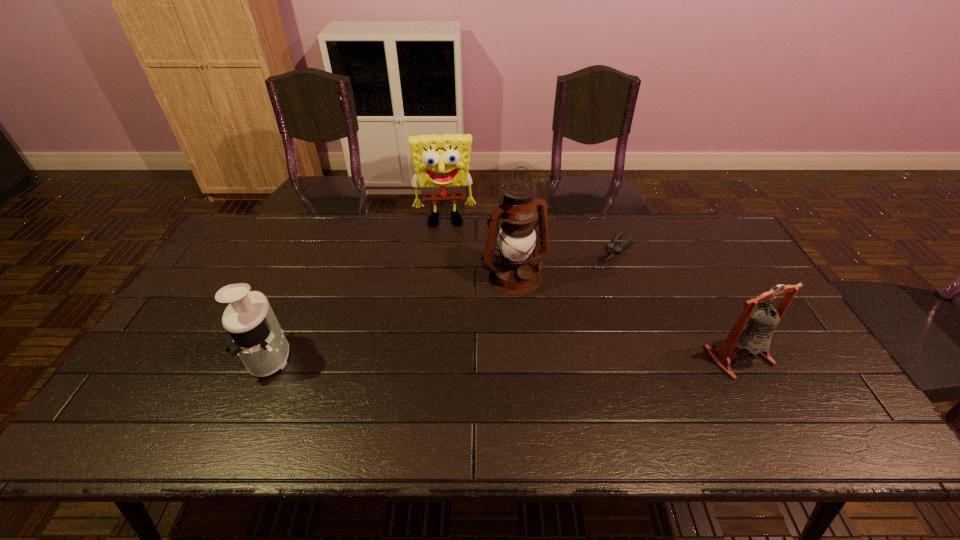
The width and height of the screenshot is (960, 540). In order to click on blank space located 0.130m on the side of the tallest object, there is a wick adjustment knob in this screenshot , I will do `click(546, 327)`.

Identify the location of free region located 0.210m on the side of the tallest object, there is a wick adjustment knob. (559, 348).

The width and height of the screenshot is (960, 540). In order to click on vacant space located on the side of the tallest object, there is a wick adjustment knob in this screenshot , I will do `click(579, 382)`.

Locate an element on the screen. The image size is (960, 540). vacant region located 0.080m on the face of the farthest object is located at coordinates (446, 246).

You are a GUI agent. You are given a task and a screenshot of the screen. Output one action in this format:
    pyautogui.click(x=<x>, y=<y>)
    Task: Click on the free space located on the face of the farthest object
    
    Given the screenshot: What is the action you would take?
    pyautogui.click(x=447, y=300)

Find the location of `free space located on the face of the farthest object`. free space located on the face of the farthest object is located at coordinates (446, 248).

This screenshot has height=540, width=960. I want to click on blank area located 0.070m at the gripping part of the second object from right to left, so click(x=596, y=271).

Identify the location of blank area located at the gripping part of the second object from right to left. (594, 273).

At what (x,y) coordinates should I click in order to perform the action: click on vacant space located 0.080m at the gripping part of the second object from right to left. Please return your answer as a coordinate pair (x, y). This screenshot has height=540, width=960. Looking at the image, I should click on (594, 273).

Identify the location of sponge that is positioned at the far edge. The width and height of the screenshot is (960, 540). (441, 162).